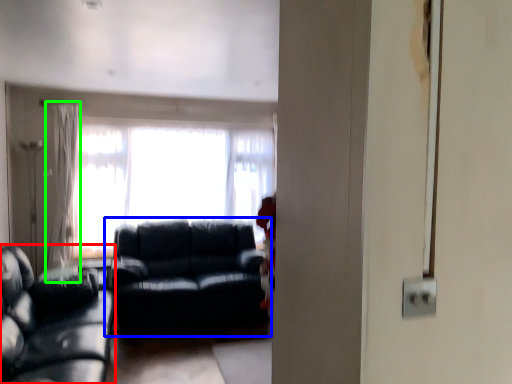
Question: Which object is the closest to the studio couch (highlighted by a red box)? Choose among these: studio couch (highlighted by a blue box) or curtain (highlighted by a green box).

Choices:
 (A) studio couch
 (B) curtain

Answer: (A)